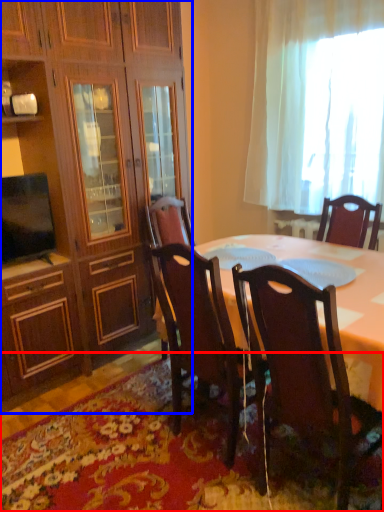
Question: Which object is further to the camera taking this photo, mat (highlighted by a red box) or cabinetry (highlighted by a blue box)?

Choices:
 (A) mat
 (B) cabinetry

Answer: (B)